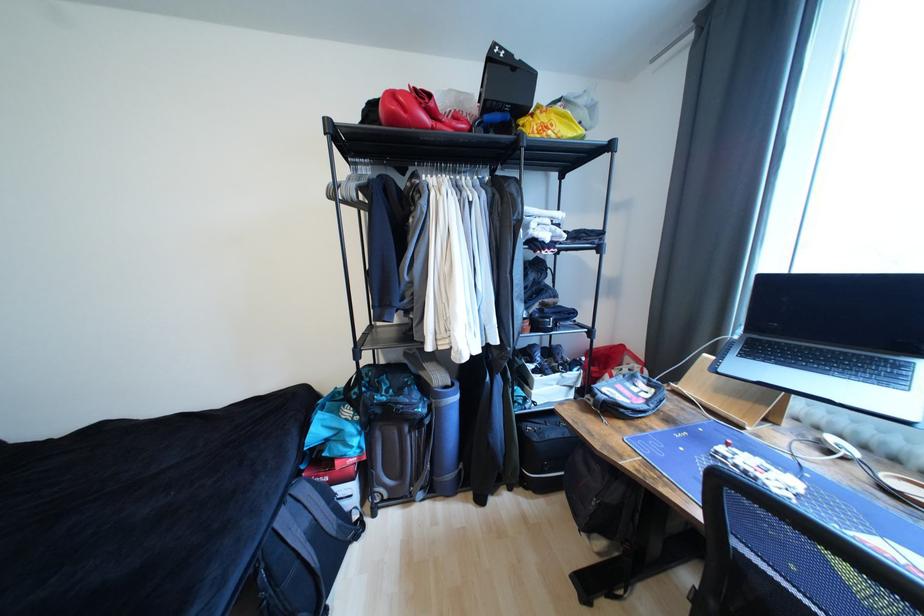
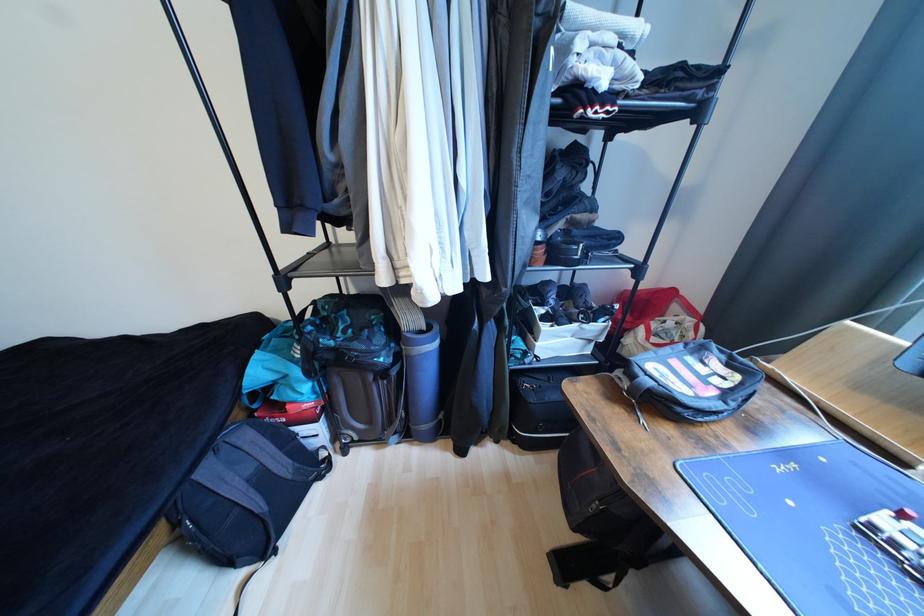
Find the pixel in the second image that matches point (289, 520) in the first image.

(215, 472)